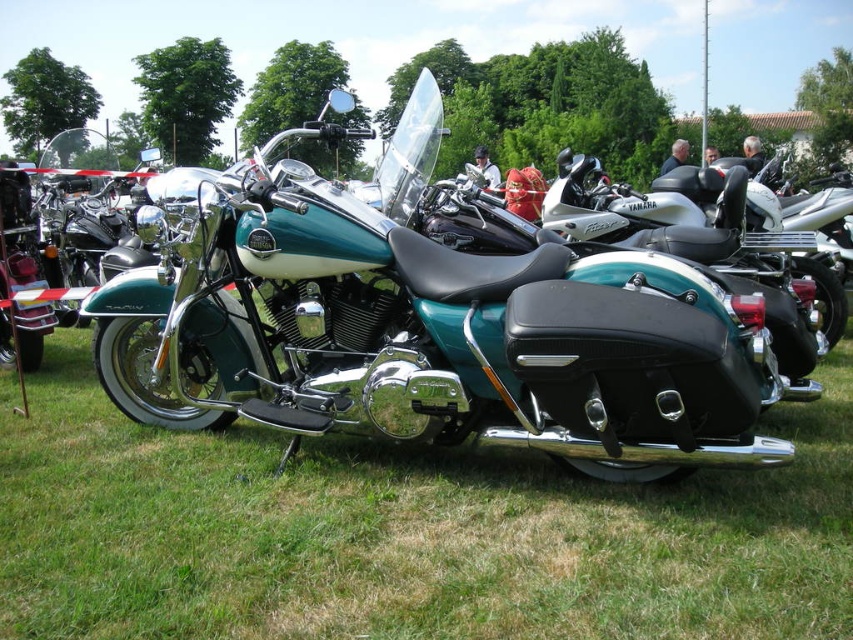
Can you confirm if green grass at center is bigger than teal metallic motorcycle at center?

No, green grass at center is not bigger than teal metallic motorcycle at center.

Does green grass at center appear under teal metallic motorcycle at center?

Correct, green grass at center is located below teal metallic motorcycle at center.

Is point (47, 548) farther from viewer compared to point (550, 257)?

No, (47, 548) is in front of (550, 257).

Image resolution: width=853 pixels, height=640 pixels. Find the location of `green grass at center`. green grass at center is located at coordinates (403, 531).

Is green grass at center thinner than teal matte/silver motorcycle at center?

No.

Is point (115, 564) positioned after point (723, 179)?

No, it is in front of (723, 179).

Locate an element on the screen. green grass at center is located at coordinates (403, 531).

Which is behind, point (409, 368) or point (572, 195)?

Point (572, 195)

Does point (144, 228) come farther from viewer compared to point (808, 272)?

No, (144, 228) is in front of (808, 272).

You are a GUI agent. You are given a task and a screenshot of the screen. Output one action in this format:
    pyautogui.click(x=<x>, y=<y>)
    Task: Click on the teal metallic motorcycle at center
    The image size is (853, 640).
    Given the screenshot: What is the action you would take?
    [x=424, y=324]

This screenshot has width=853, height=640. Identify the location of teal metallic motorcycle at center. (424, 324).